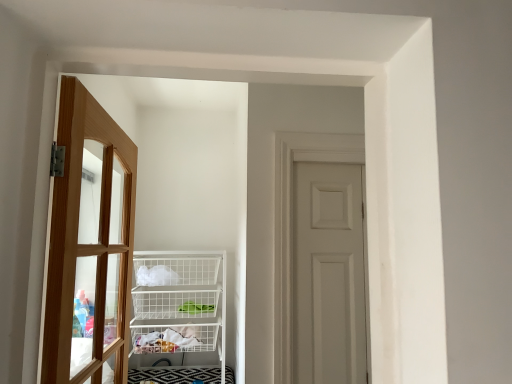
Question: Considering the relative sizes of light brown wooden door at left, the 1th door from the front, and white matte door at center, placed as the 1th door when sorted from right to left, in the image provided, is light brown wooden door at left, the 1th door from the front, thinner than white matte door at center, placed as the 1th door when sorted from right to left,?

Choices:
 (A) no
 (B) yes

Answer: (A)

Question: Would you consider light brown wooden door at left, the 1th door from the front, to be distant from white matte door at center, placed as the 1th door when sorted from right to left?

Choices:
 (A) no
 (B) yes

Answer: (A)

Question: Is white matte door at center, the 1th door when ordered from back to front, located within light brown wooden door at left, which is the 2th door from right to left?

Choices:
 (A) no
 (B) yes

Answer: (A)

Question: From the image's perspective, would you say light brown wooden door at left, which appears as the 2th door when viewed from the back, is shown under white matte door at center, the 1th door when ordered from back to front?

Choices:
 (A) no
 (B) yes

Answer: (A)

Question: Can you confirm if light brown wooden door at left, placed as the first door when sorted from left to right, is shorter than white matte door at center, placed as the 1th door when sorted from right to left?

Choices:
 (A) no
 (B) yes

Answer: (A)

Question: Is point (48, 317) positioned closer to the camera than point (222, 309)?

Choices:
 (A) closer
 (B) farther

Answer: (A)

Question: Choose the correct answer: Is light brown wooden door at left, which appears as the 2th door when viewed from the back, inside white wire basket at center or outside it?

Choices:
 (A) outside
 (B) inside

Answer: (A)

Question: In terms of size, does light brown wooden door at left, placed as the first door when sorted from left to right, appear bigger or smaller than white wire basket at center?

Choices:
 (A) big
 (B) small

Answer: (B)

Question: In terms of height, does light brown wooden door at left, placed as the first door when sorted from left to right, look taller or shorter compared to white wire basket at center?

Choices:
 (A) short
 (B) tall

Answer: (B)

Question: From a real-world perspective, is white wire basket at center above or below light brown wooden door at left, placed as the first door when sorted from left to right?

Choices:
 (A) above
 (B) below

Answer: (B)

Question: Looking at their shapes, would you say white wire basket at center is wider or thinner than light brown wooden door at left, which appears as the 2th door when viewed from the back?

Choices:
 (A) thin
 (B) wide

Answer: (B)

Question: From the image's perspective, is white wire basket at center above or below light brown wooden door at left, which appears as the 2th door when viewed from the back?

Choices:
 (A) below
 (B) above

Answer: (A)

Question: Considering their positions, is white wire basket at center located in front of or behind light brown wooden door at left, placed as the first door when sorted from left to right?

Choices:
 (A) front
 (B) behind

Answer: (B)

Question: In the image, is white matte door at center, the 1th door when ordered from back to front, positioned in front of or behind light brown wooden door at left, which appears as the 2th door when viewed from the back?

Choices:
 (A) behind
 (B) front

Answer: (A)

Question: Is white matte door at center, placed as the 1th door when sorted from right to left, inside the boundaries of light brown wooden door at left, which appears as the 2th door when viewed from the back, or outside?

Choices:
 (A) inside
 (B) outside

Answer: (B)